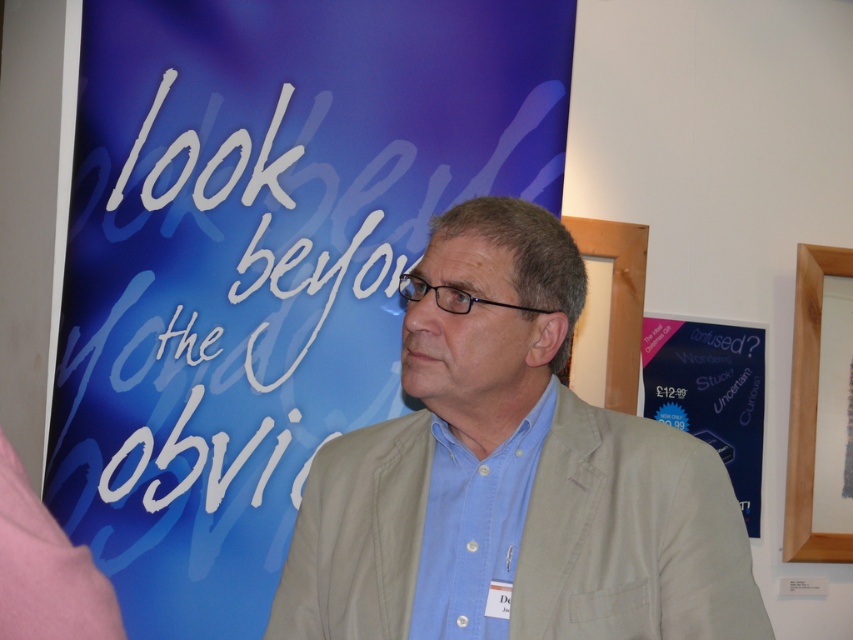
You are a photographer standing 5 feet away from the man in the image. You want to take a closeup shot of the blue cotton shirt at center without moving the camera. Is the distance sufficient for a clear closeup?

The blue cotton shirt at center is 39.20 inches from the viewer. Since 5 feet equals 60 inches, the distance is sufficient for a clear closeup without moving the camera.

You are designing a layout for a poster display and need to place the blue cotton shirt at center and the wooden frame at upper right. Considering their thickness, which object should you avoid placing in narrow spaces?

The blue cotton shirt at center is thinner than the wooden frame at upper right, so the wooden frame at upper right is thicker and should be avoided in narrow spaces.

You are an event organizer arranging a presentation. You need to place a name tag holder that is 15 cm wide between the blue cotton shirt at center and the wooden frame at upper right. Is there enough space between them to fit the name tag holder?

The blue cotton shirt at center is to the left of the wooden frame at upper right, so there is space between them. Since the name tag holder is 15 cm wide, you should measure the distance between the blue cotton shirt at center and the wooden frame at upper right to confirm if it is at least 15 cm. Without exact measurements, we can assume there is sufficient space as objects are positioned apart.